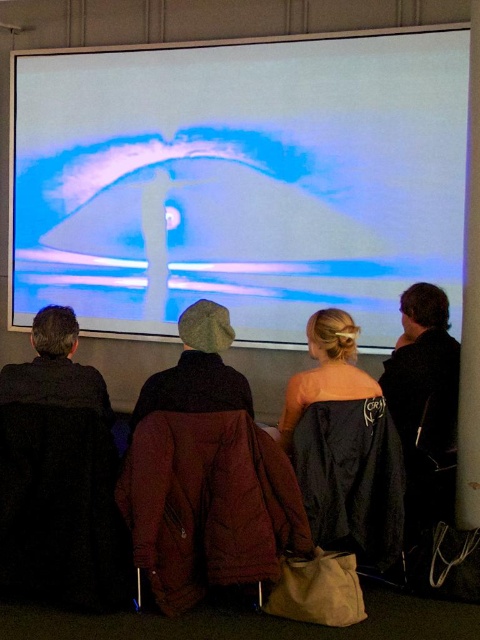
You are standing in the room where the projection screen is displayed. There is a point at coordinates (240,180) on the white glossy projection screen at upper center. If you were to draw a line from your eye level to this point, would it intersect with any of the audience members?

The point at (240,180) on the white glossy projection screen at upper center is located at the upper center area of the screen. Since the audience members are seated in front of the screen with their backs to the camera, their bodies would block the line of sight from your position to the upper center of the screen. Therefore, the line would intersect with the audience members.

You are standing in front of the projection screen and want to move to a position where you can see both the point at coordinates [436,369] and the point at [345,365] clearly. Based on their positions, which point is closer to the screen?

Point [345,365] is closer to the screen than point [436,369] because the first point is in front of the second one.